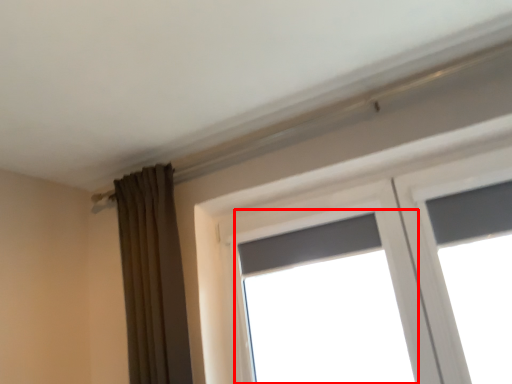
Question: Considering the relative positions of window (annotated by the red box) and curtain in the image provided, where is window (annotated by the red box) located with respect to the staircase?

Choices:
 (A) right
 (B) left

Answer: (A)